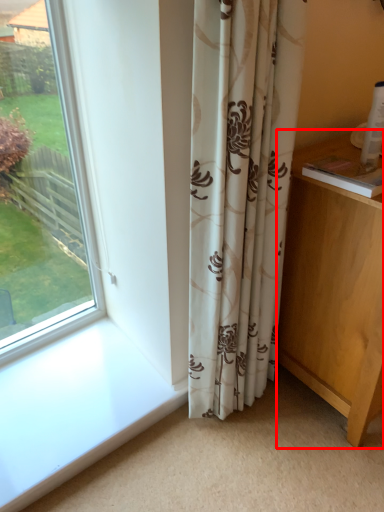
Question: Where is vanity (annotated by the red box) located in relation to curtain in the image?

Choices:
 (A) right
 (B) left

Answer: (A)